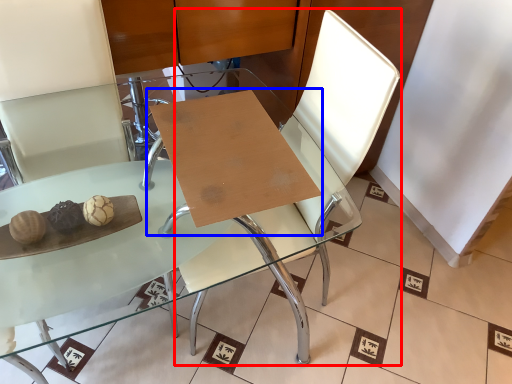
Question: Which of the following is the farthest to the observer, swivel chair (highlighted by a red box) or table (highlighted by a blue box)?

Choices:
 (A) swivel chair
 (B) table

Answer: (B)